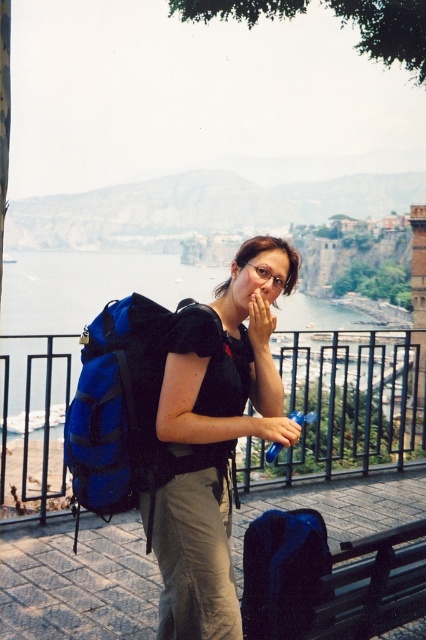
Is metal/rusty rail at left to the right of matte black hand at center from the viewer's perspective?

Correct, you'll find metal/rusty rail at left to the right of matte black hand at center.

Between point (49, 404) and point (282, 442), which one is positioned in front?

Point (282, 442)

Identify the location of metal/rusty rail at left. (345, 404).

Who is more distant from viewer, (74, 449) or (293, 422)?

The point (293, 422) is behind.

Is blue fabric backpack at center further to the viewer compared to matte black hand at center?

That is False.

Is point (180, 305) positioned before point (271, 433)?

That is False.

The width and height of the screenshot is (426, 640). Identify the location of blue fabric backpack at center. (123, 404).

Who is more distant from viewer, (267,314) or (54,296)?

Point (54,296)

Is black matte backpack at center smaller than blue fabric water at center?

Yes.

Who is more forward, (273, 257) or (164, 268)?

Positioned in front is point (273, 257).

Where is `black matte backpack at center`? The image size is (426, 640). black matte backpack at center is located at coordinates (212, 436).